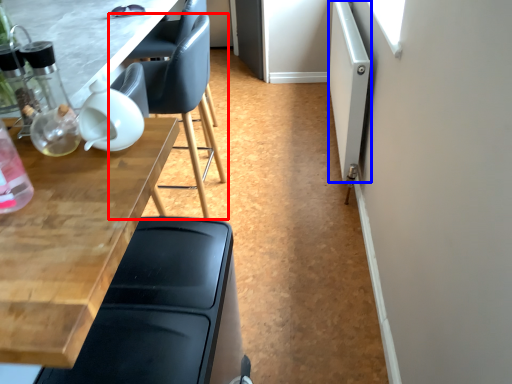
Question: Which object appears closest to the camera in this image, chair (highlighted by a red box) or screen door (highlighted by a blue box)?

Choices:
 (A) chair
 (B) screen door

Answer: (A)